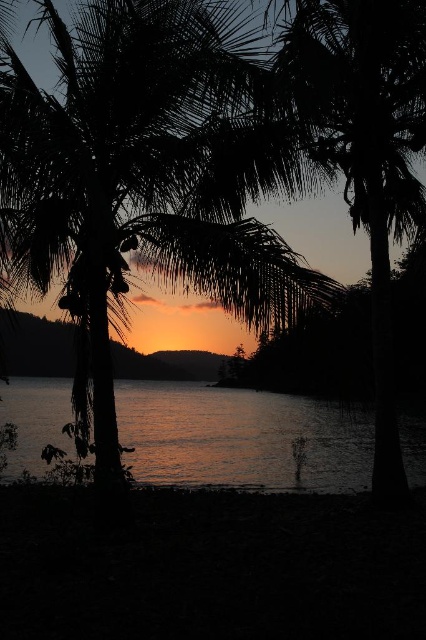
Is point (58, 262) farther from viewer compared to point (261, 461)?

That is False.

Is point (57, 51) positioned in front of point (43, 397)?

Yes, it is.

What are the coordinates of `silhouette leafy palm at center` in the screenshot? It's located at (146, 177).